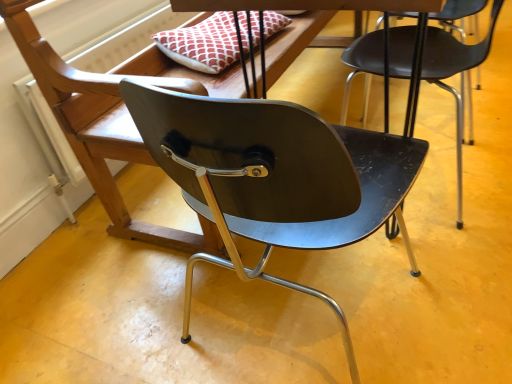
What are the coordinates of `vacant area in front of matte black chair at center, acting as the second chair starting from the left` in the screenshot? It's located at (467, 236).